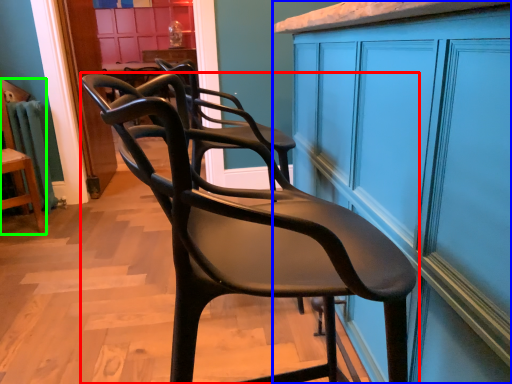
Question: Which object is the closest to the chair (highlighted by a red box)? Choose among these: cabinetry (highlighted by a blue box) or chair (highlighted by a green box).

Choices:
 (A) cabinetry
 (B) chair

Answer: (A)